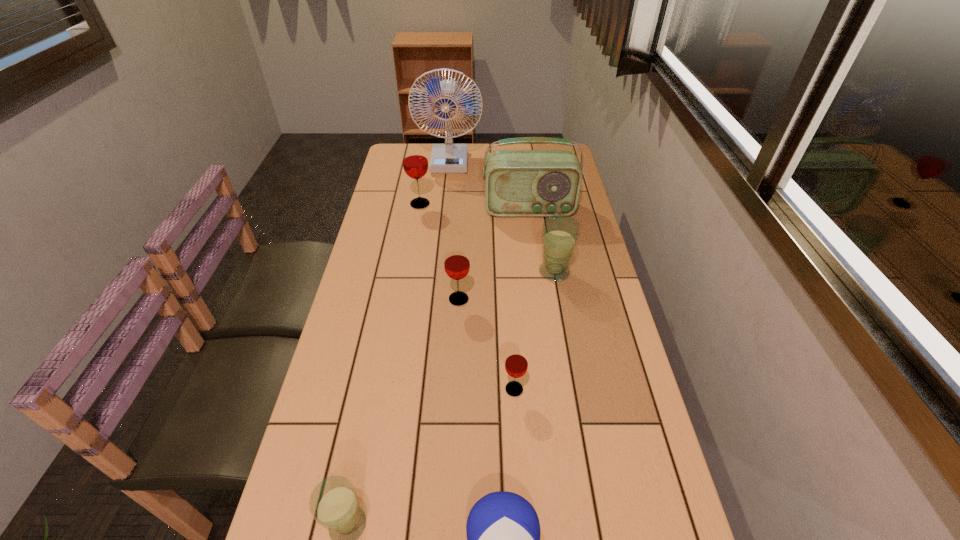
This screenshot has width=960, height=540. I want to click on free region that satisfies the following two spatial constraints: 1. on the front panel of the bigger blue glass; 2. on the left side of the radio receiver, so click(x=538, y=272).

The width and height of the screenshot is (960, 540). I want to click on free space in the image that satisfies the following two spatial constraints: 1. on the front-facing side of the sixth farthest object; 2. on the left side of the blue fan, so click(x=427, y=389).